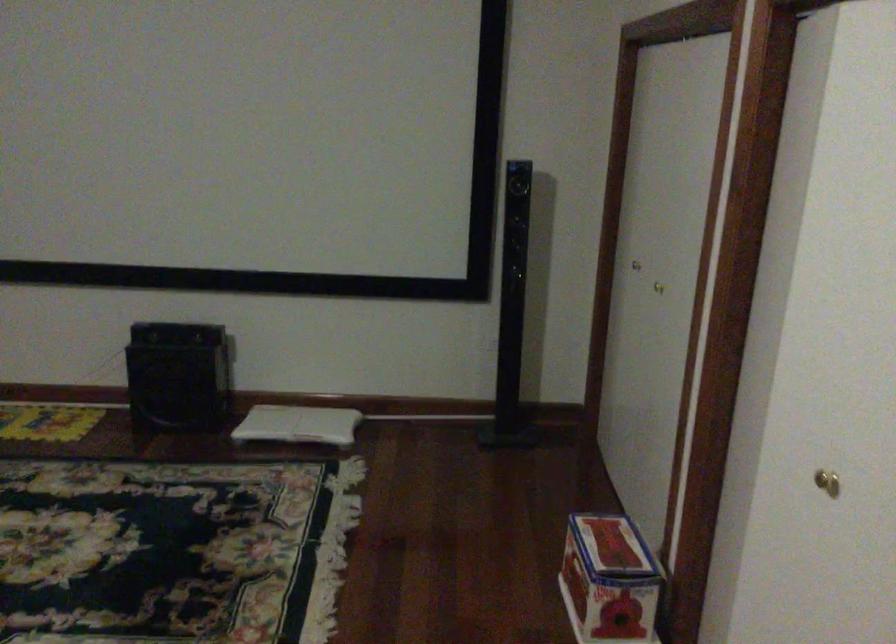
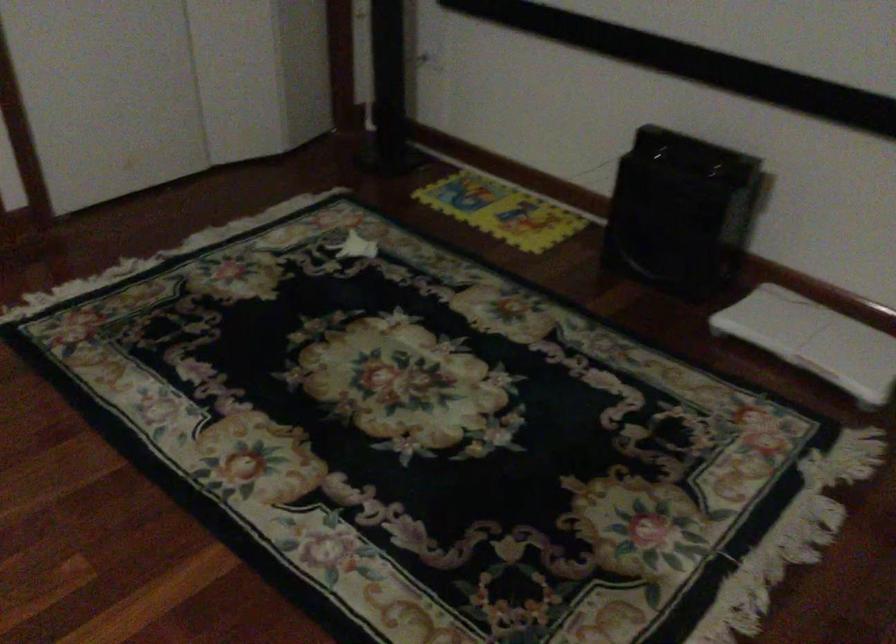
Locate, in the second image, the point that corresponds to (x=297, y=422) in the first image.

(814, 339)